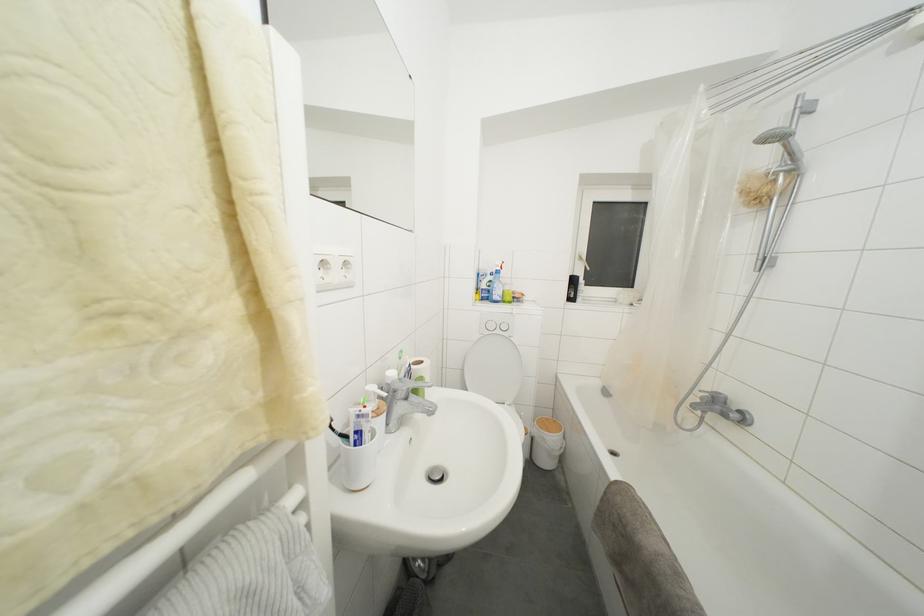
What do you see at coordinates (435, 474) in the screenshot? The width and height of the screenshot is (924, 616). I see `the faucet diverter knob` at bounding box center [435, 474].